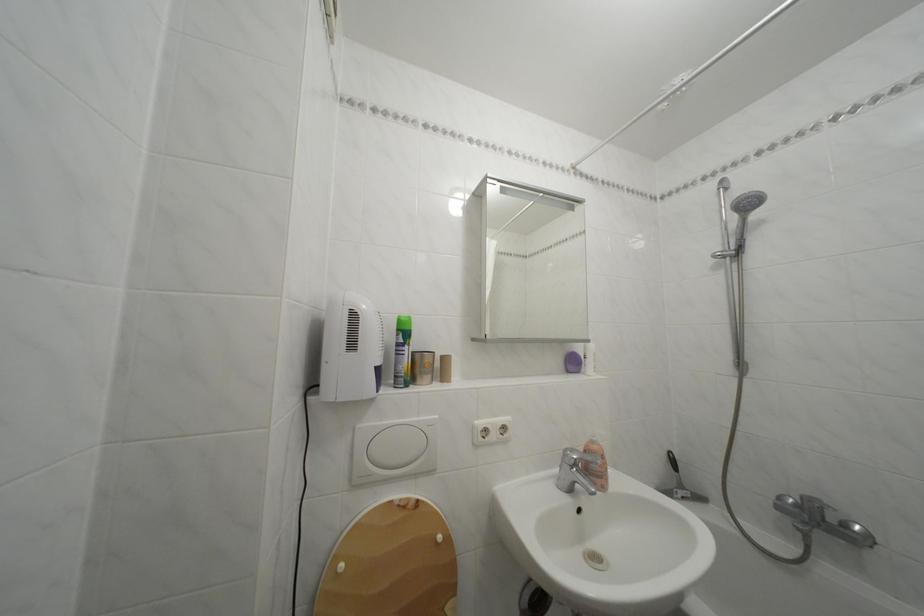
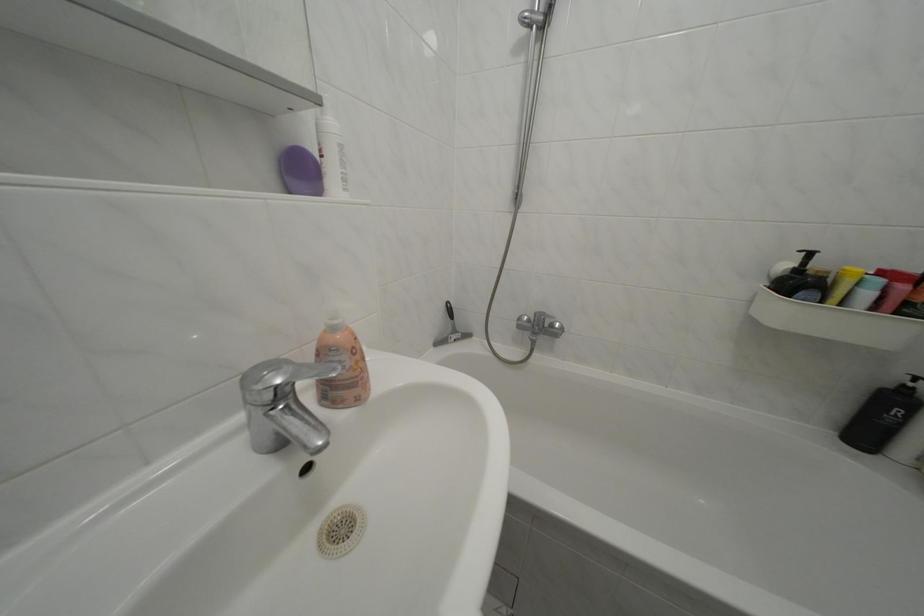
The point at [574,458] is marked in the first image. Where is the corresponding point in the second image?

(252, 384)